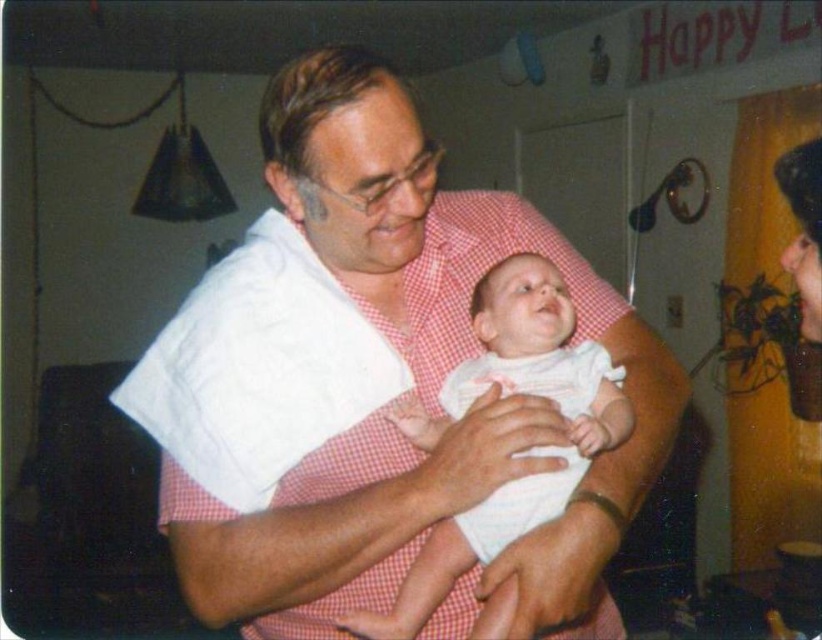
Who is positioned more to the left, white clothed arm at center or smooth skin face at right?

From the viewer's perspective, white clothed arm at center appears more on the left side.

Does white clothed arm at center lie behind smooth skin face at right?

That is False.

Find the location of `white clothed arm at center`. white clothed arm at center is located at coordinates (354, 516).

Does white cotton shirt at center appear under white clothed arm at center?

Actually, white cotton shirt at center is above white clothed arm at center.

Does white cotton shirt at center appear over white clothed arm at center?

Indeed, white cotton shirt at center is positioned over white clothed arm at center.

Locate an element on the screen. This screenshot has height=640, width=822. white cotton shirt at center is located at coordinates (372, 385).

Find the location of `white cotton shirt at center`. white cotton shirt at center is located at coordinates (372, 385).

Which is behind, point (493, 372) or point (802, 177)?

The point (493, 372) is more distant.

Where is `white cotton baby at center`? The image size is (822, 640). white cotton baby at center is located at coordinates (x=530, y=451).